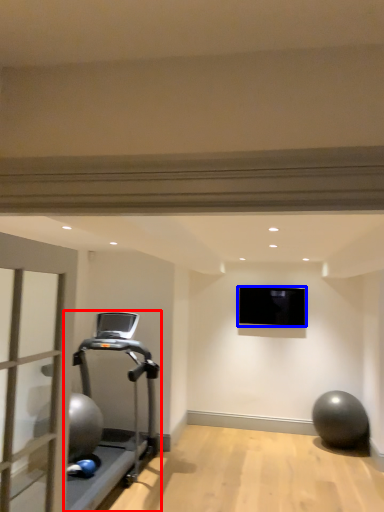
Question: Which of the following is the closest to the observer, treadmill (highlighted by a red box) or projection screen (highlighted by a blue box)?

Choices:
 (A) treadmill
 (B) projection screen

Answer: (A)